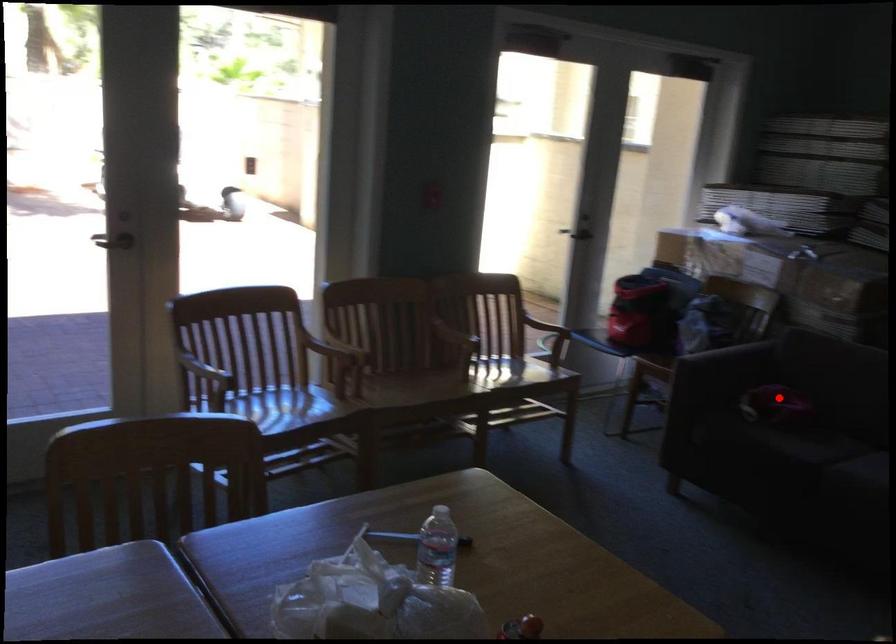
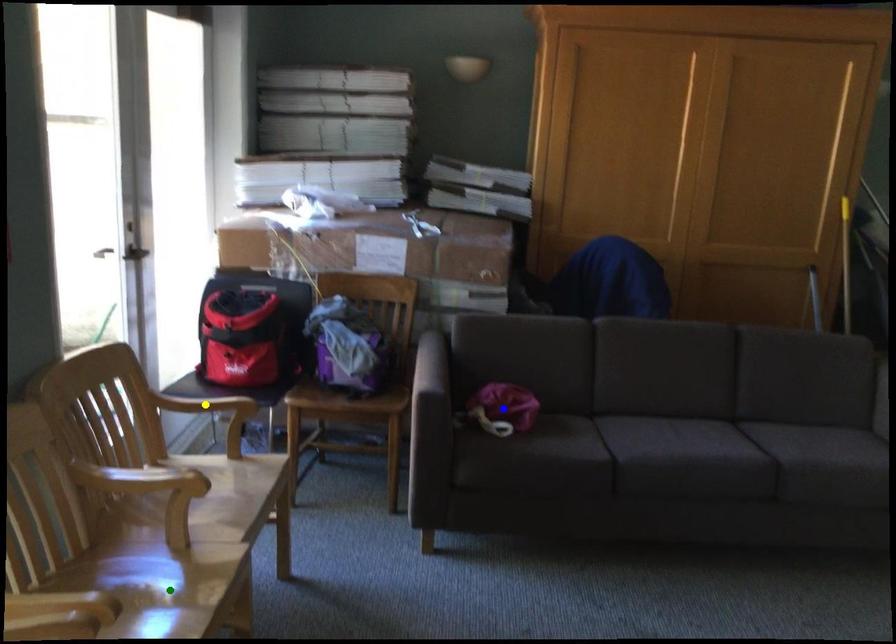
Question: I am providing you with two images of the same scene from different viewpoints. A red point is marked on the first image. You are given multiple points on the second image. Can you choose the point in image 2 that corresponds to the point in image 1?

Choices:
 (A) blue point
 (B) yellow point
 (C) green point

Answer: (A)